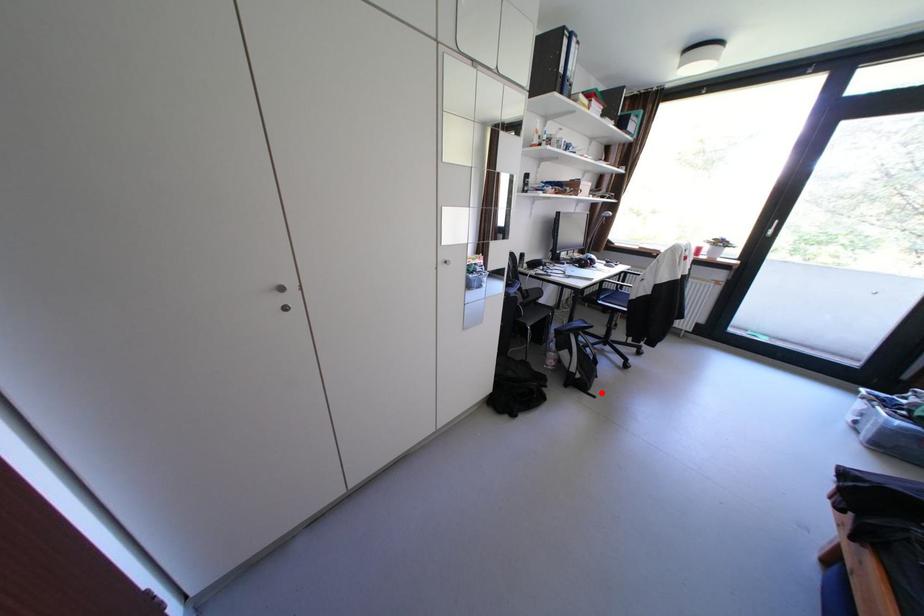
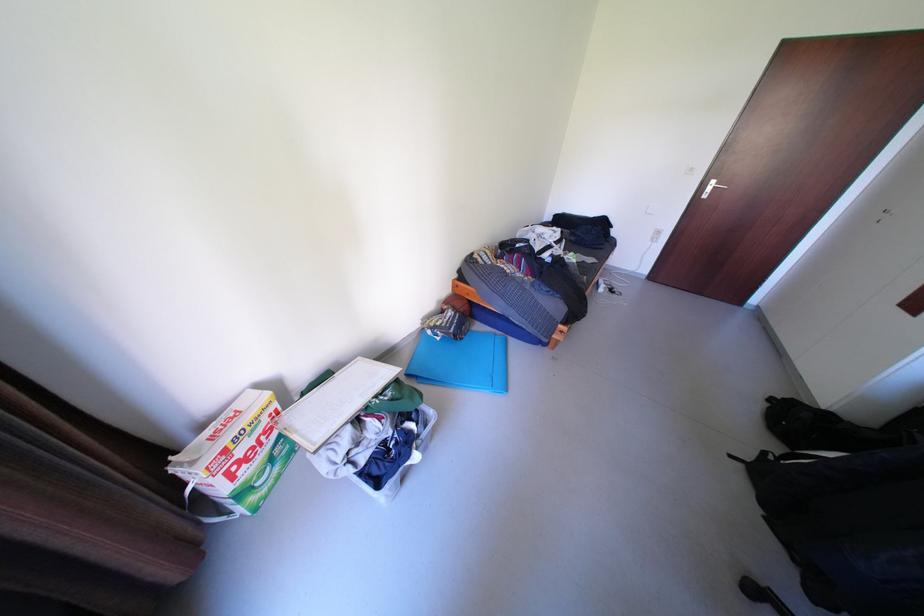
In the second image, find the point that corresponds to the highlighted location in the first image.

(752, 466)